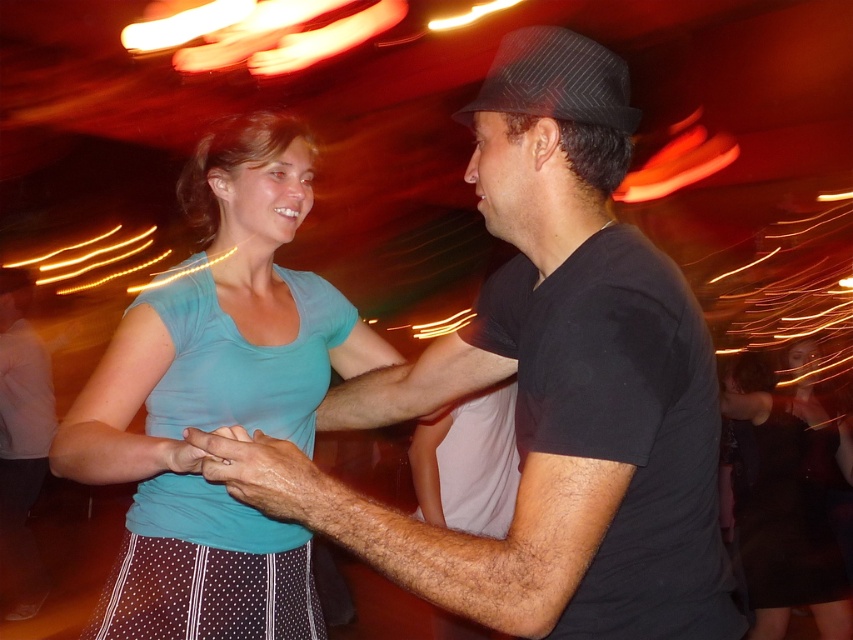
Is black matte shirt at center below teal fabric skirt at center?

No.

Measure the distance between point (248, 483) and camera.

Point (248, 483) is 35.33 inches away from camera.

Image resolution: width=853 pixels, height=640 pixels. What do you see at coordinates (547, 388) in the screenshot?
I see `black matte shirt at center` at bounding box center [547, 388].

Where is `black matte shirt at center`? black matte shirt at center is located at coordinates (547, 388).

Measure the distance between teal matte shirt at center and camera.

teal matte shirt at center is 37.64 inches from camera.

The width and height of the screenshot is (853, 640). Describe the element at coordinates (218, 400) in the screenshot. I see `teal matte shirt at center` at that location.

What are the coordinates of `teal matte shirt at center` in the screenshot? It's located at (218, 400).

Find the location of a particular element. Image resolution: width=853 pixels, height=640 pixels. teal matte shirt at center is located at coordinates (218, 400).

Measure the distance between black matte shirt at center and teal matte shirt at center.

A distance of 16.02 inches exists between black matte shirt at center and teal matte shirt at center.

Is point (712, 520) in front of point (225, 497)?

Yes.

Does point (669, 492) lie in front of point (198, 298)?

Yes, point (669, 492) is closer to viewer.

What are the coordinates of `black matte shirt at center` in the screenshot? It's located at (547, 388).